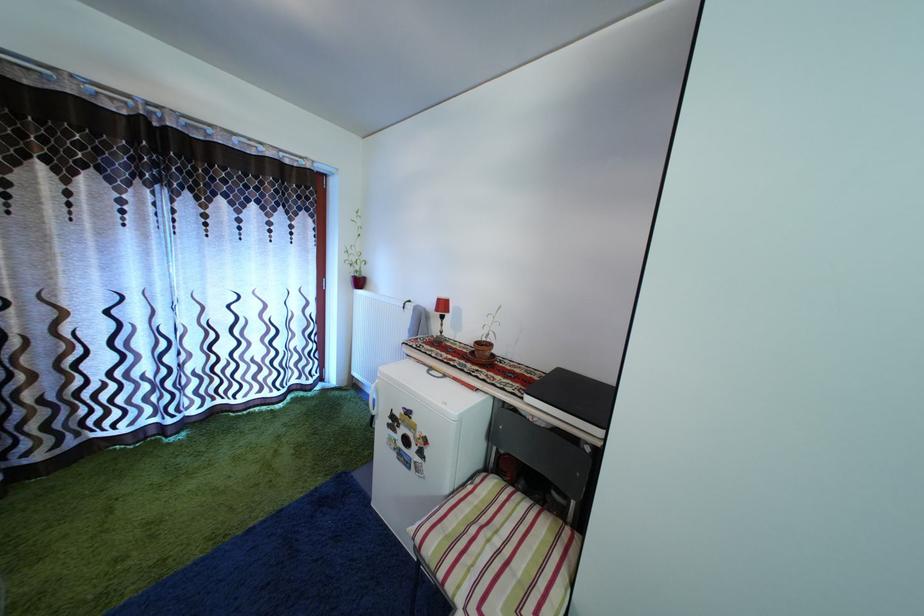
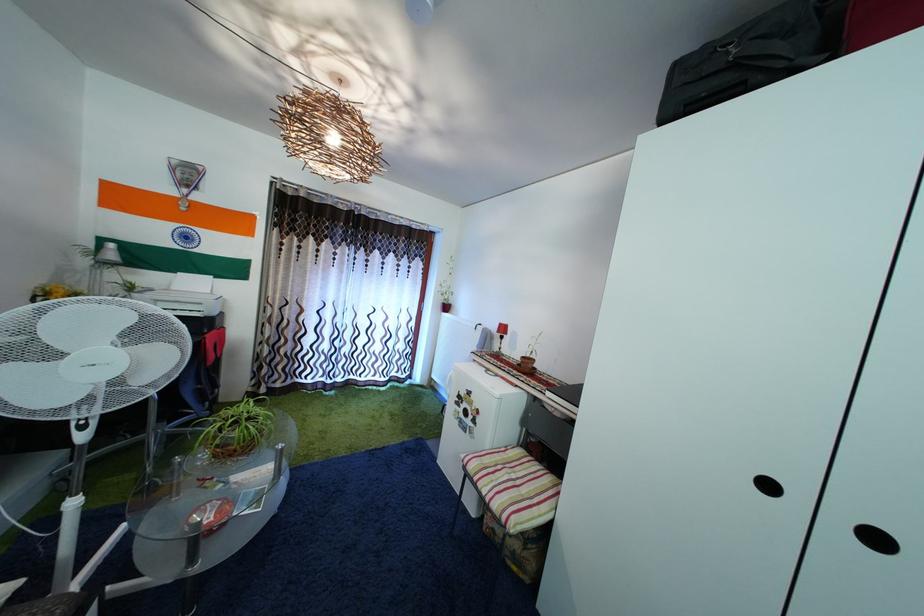
Find the pixel in the second image that matches point (505, 549) in the first image.

(521, 484)